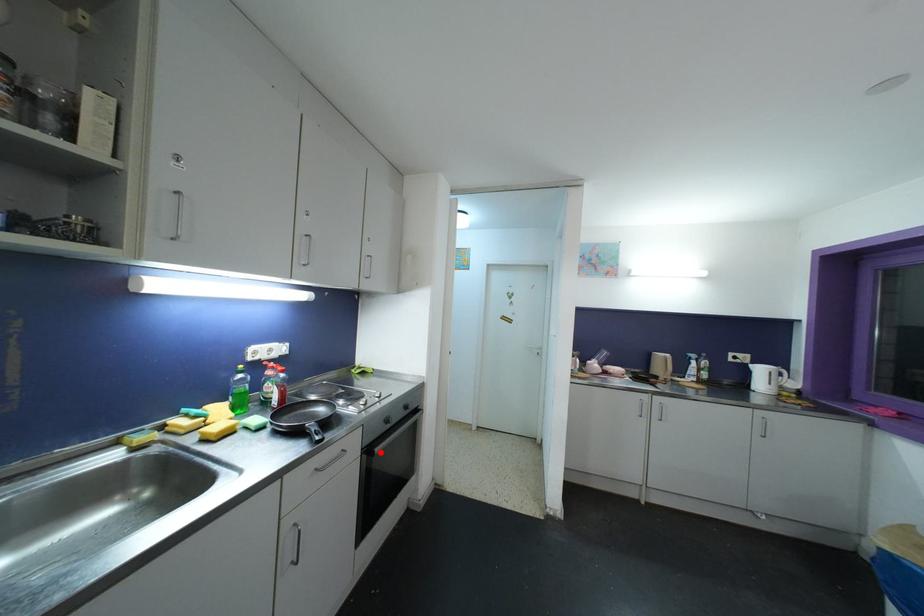
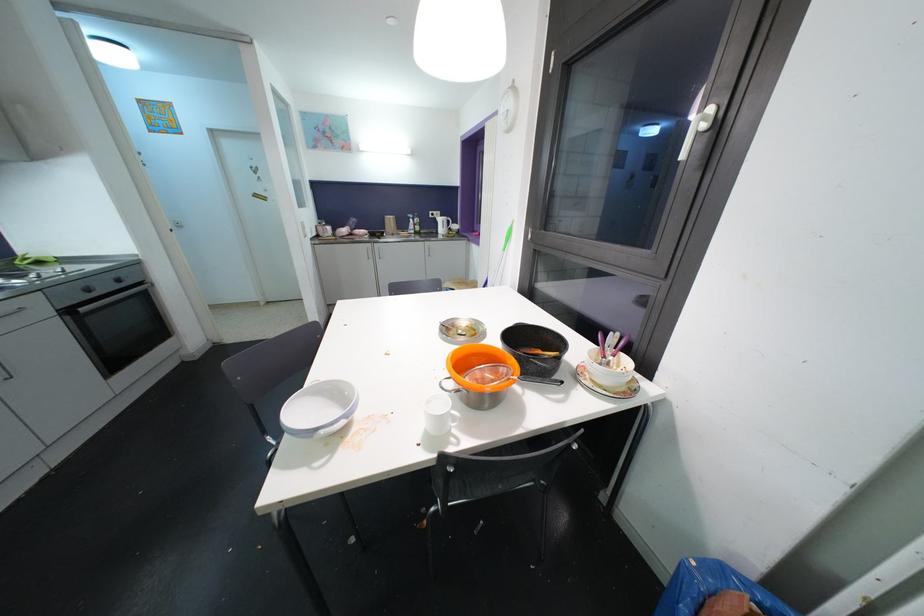
Question: I am providing you with two images of the same scene from different viewpoints. A red point is marked on the first image. Is the red point's position out of view in image 2?

Choices:
 (A) Yes
 (B) No

Answer: (B)